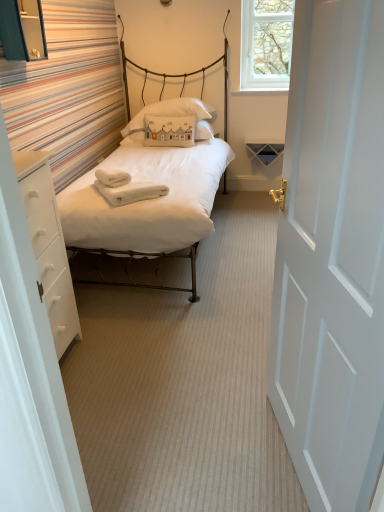
Question: Is white soft towel at center taller or shorter than white soft towels at center?

Choices:
 (A) tall
 (B) short

Answer: (A)

Question: Is white soft towel at center spatially inside white soft towels at center, or outside of it?

Choices:
 (A) inside
 (B) outside

Answer: (B)

Question: Considering the real-world distances, which object is closest to the matte white bed at center?

Choices:
 (A) white soft towel at center
 (B) white soft towels at center
 (C) white painted wood door at right
 (D) white fabric pillow at center
 (E) white matte drawer at left

Answer: (A)

Question: Which object is positioned closest to the white matte drawer at left?

Choices:
 (A) white painted wood door at right
 (B) white fabric pillow at center
 (C) matte white bed at center
 (D) white soft towels at center
 (E) clear glass window at upper right

Answer: (D)